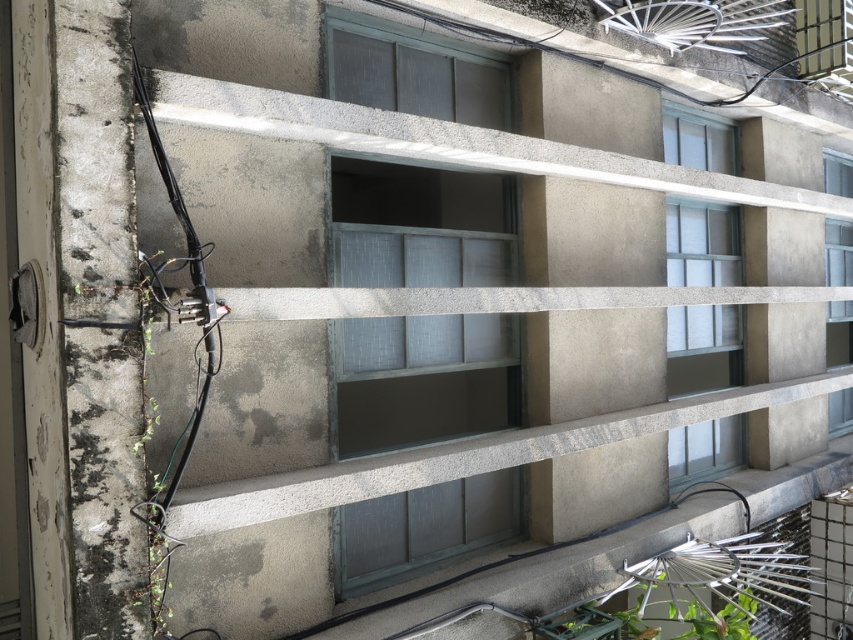
Question: Estimate the real-world distances between objects in this image. Which object is farther from the clear glass window at center-right?

Choices:
 (A) green textured glass window at center
 (B) clear glass window at upper right

Answer: (B)

Question: Can you confirm if green textured glass window at center is wider than clear glass window at upper right?

Choices:
 (A) yes
 (B) no

Answer: (A)

Question: Which point is closer to the camera?

Choices:
 (A) clear glass window at upper right
 (B) green textured glass window at center

Answer: (B)

Question: Can you confirm if green textured glass window at center is positioned to the left of clear glass window at center-right?

Choices:
 (A) yes
 (B) no

Answer: (A)

Question: In this image, where is clear glass window at center-right located relative to clear glass window at upper right?

Choices:
 (A) above
 (B) below

Answer: (B)

Question: Estimate the real-world distances between objects in this image. Which object is closer to the clear glass window at center-right?

Choices:
 (A) green textured glass window at center
 (B) clear glass window at upper right

Answer: (A)